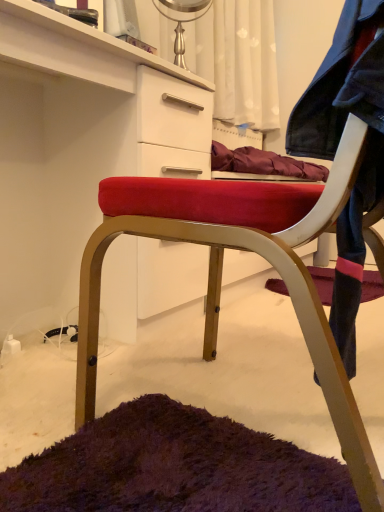
Question: Considering the relative sizes of faded denim jacket at lower right and velvet red chair at center in the image provided, is faded denim jacket at lower right smaller than velvet red chair at center?

Choices:
 (A) yes
 (B) no

Answer: (A)

Question: From a real-world perspective, is faded denim jacket at lower right over velvet red chair at center?

Choices:
 (A) no
 (B) yes

Answer: (B)

Question: Is faded denim jacket at lower right to the left of velvet red chair at center from the viewer's perspective?

Choices:
 (A) yes
 (B) no

Answer: (B)

Question: Is faded denim jacket at lower right positioned in front of velvet red chair at center?

Choices:
 (A) yes
 (B) no

Answer: (A)

Question: Considering the relative sizes of faded denim jacket at lower right and velvet red chair at center in the image provided, is faded denim jacket at lower right shorter than velvet red chair at center?

Choices:
 (A) no
 (B) yes

Answer: (B)

Question: Considering the positions of faded denim jacket at lower right and velvet red chair at center in the image, is faded denim jacket at lower right taller or shorter than velvet red chair at center?

Choices:
 (A) tall
 (B) short

Answer: (B)

Question: Is faded denim jacket at lower right bigger or smaller than velvet red chair at center?

Choices:
 (A) big
 (B) small

Answer: (B)

Question: From a real-world perspective, is faded denim jacket at lower right positioned above or below velvet red chair at center?

Choices:
 (A) above
 (B) below

Answer: (A)

Question: Relative to velvet red chair at center, is faded denim jacket at lower right in front or behind?

Choices:
 (A) front
 (B) behind

Answer: (A)

Question: Is velvet red chair at center in front of or behind faded denim jacket at lower right in the image?

Choices:
 (A) front
 (B) behind

Answer: (B)

Question: Is point (92, 313) positioned closer to the camera than point (299, 141)?

Choices:
 (A) farther
 (B) closer

Answer: (A)

Question: Is velvet red chair at center inside the boundaries of faded denim jacket at lower right, or outside?

Choices:
 (A) outside
 (B) inside

Answer: (A)

Question: From the image's perspective, is velvet red chair at center above or below faded denim jacket at lower right?

Choices:
 (A) below
 (B) above

Answer: (A)

Question: From the image's perspective, is velvet red chair at center positioned above or below velvet red chair at center?

Choices:
 (A) above
 (B) below

Answer: (B)

Question: Looking at their shapes, would you say velvet red chair at center is wider or thinner than velvet red chair at center?

Choices:
 (A) thin
 (B) wide

Answer: (B)